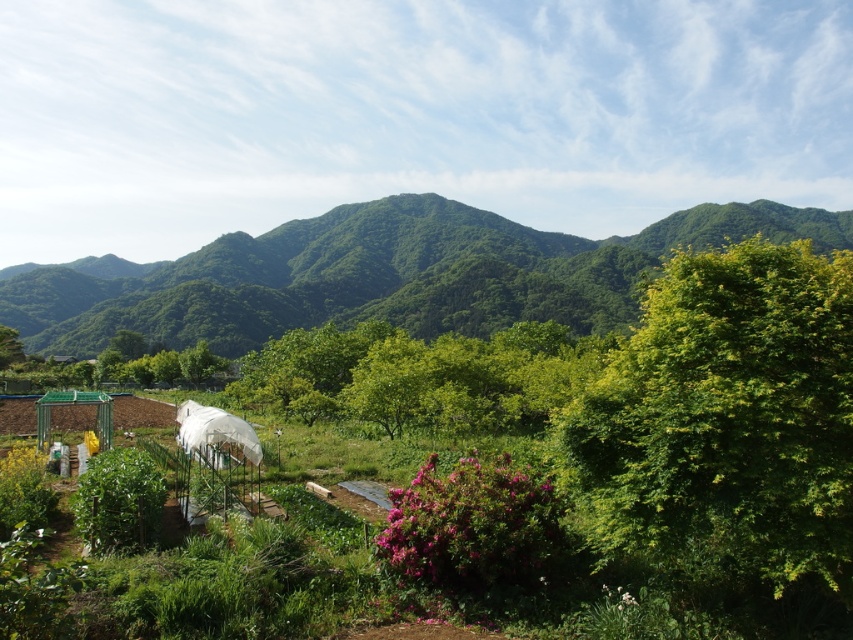
Question: Can you confirm if green plastic greenhouse at lower left is smaller than green leafy mountain at upper center?

Choices:
 (A) no
 (B) yes

Answer: (B)

Question: Which point is closer to the camera?

Choices:
 (A) green plastic greenhouse at lower left
 (B) green leafy mountain at upper center

Answer: (A)

Question: Which point is farther to the camera?

Choices:
 (A) (708, 529)
 (B) (584, 257)

Answer: (B)

Question: Does green plastic greenhouse at lower left have a smaller size compared to green leafy mountain at upper center?

Choices:
 (A) no
 (B) yes

Answer: (B)

Question: Which point appears farthest from the camera in this image?

Choices:
 (A) (664, 376)
 (B) (173, 326)

Answer: (B)

Question: Can you confirm if green plastic greenhouse at lower left is smaller than green leafy mountain at upper center?

Choices:
 (A) no
 (B) yes

Answer: (B)